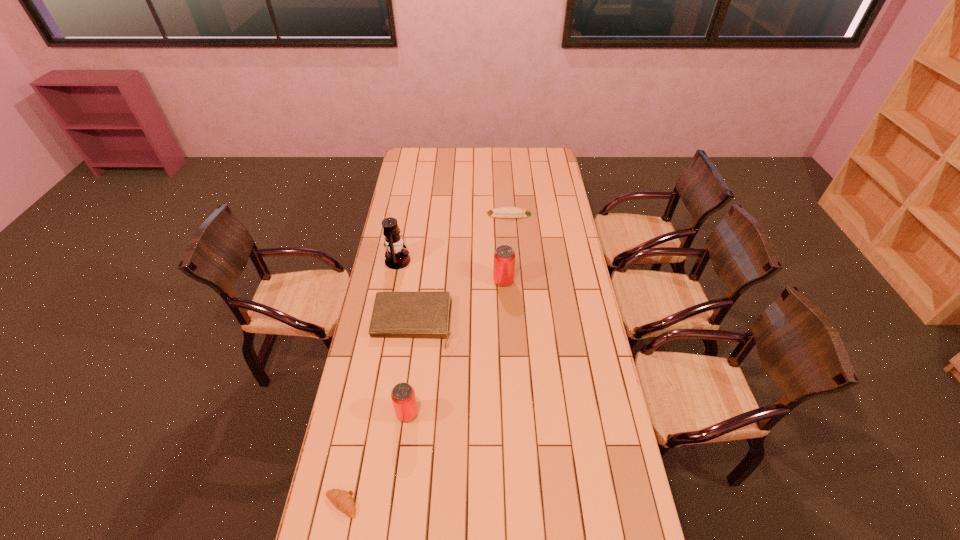
This screenshot has height=540, width=960. Identify the location of vacant space located on the right of the second nearest object. [x=534, y=414].

The height and width of the screenshot is (540, 960). Identify the location of free spot located 0.150m on the left of the fifth shortest object. (460, 281).

Locate an element on the screen. This screenshot has width=960, height=540. vacant space positioned 0.180m at the bitten end of the farthest object is located at coordinates (452, 214).

Where is `vacant space located 0.370m at the bitten end of the farthest object`? vacant space located 0.370m at the bitten end of the farthest object is located at coordinates [x=416, y=214].

The image size is (960, 540). Find the location of `blank space located 0.060m at the bitten end of the farthest object`. blank space located 0.060m at the bitten end of the farthest object is located at coordinates (475, 214).

Find the location of a particular element. vacant point located on the spine side of the paperback book is located at coordinates 397,435.

Where is `blank space located 0.310m on the side of the tallest object, there is a wick adjustment knob`? The height and width of the screenshot is (540, 960). blank space located 0.310m on the side of the tallest object, there is a wick adjustment knob is located at coordinates (477, 260).

The image size is (960, 540). What are the coordinates of `vacant area situated on the back of the crescent roll` in the screenshot? It's located at (356, 428).

Find the location of `object located in the near edge section of the desktop`. object located in the near edge section of the desktop is located at coordinates (342, 500).

The height and width of the screenshot is (540, 960). What are the coordinates of `paperback book present at the left edge` in the screenshot? It's located at (395, 314).